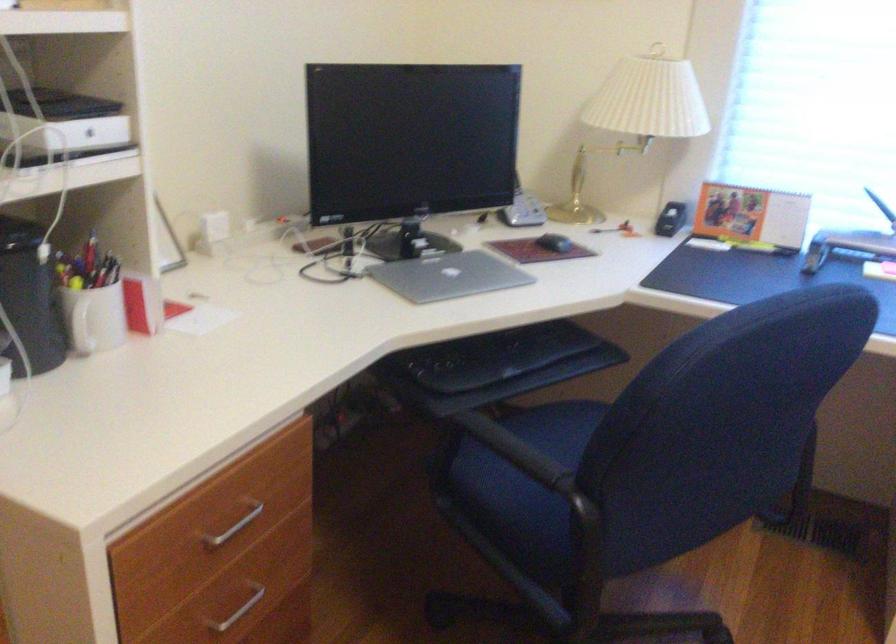
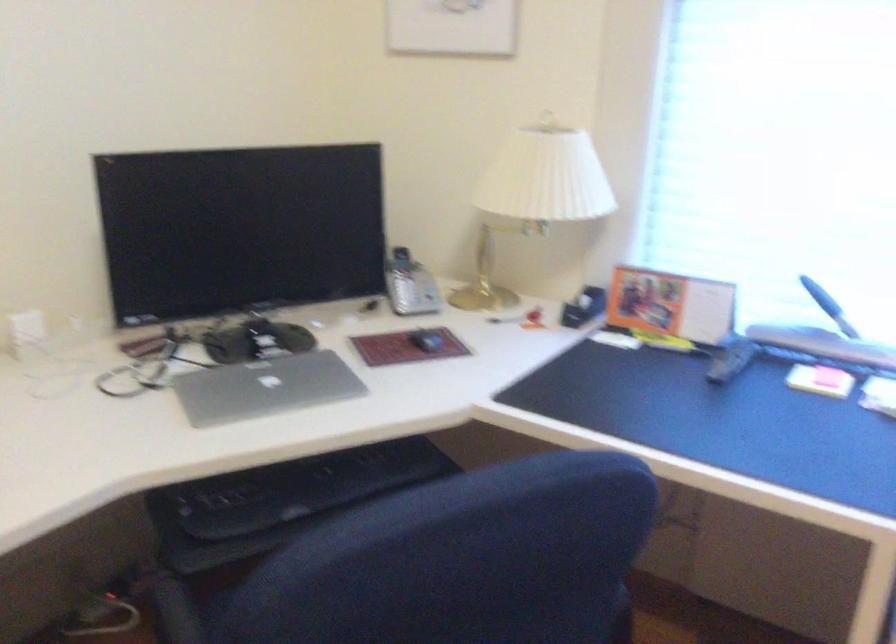
Find the pixel in the second image that matches (x=513, y=198) in the first image.

(401, 281)